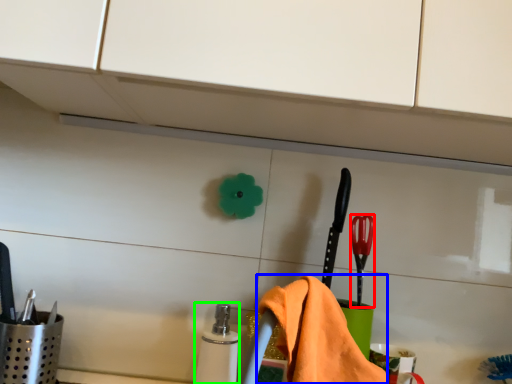
Question: Which object is positioned closest to brush (highlighted by a red box)? Select from bath towel (highlighted by a blue box) and toiletry (highlighted by a green box).

Choices:
 (A) bath towel
 (B) toiletry

Answer: (A)